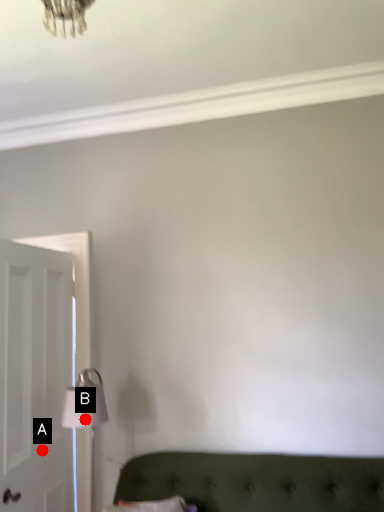
Question: Two points are circled on the image, labeled by A and B beside each circle. Which point is further to the camera?

Choices:
 (A) A is further
 (B) B is further

Answer: (A)